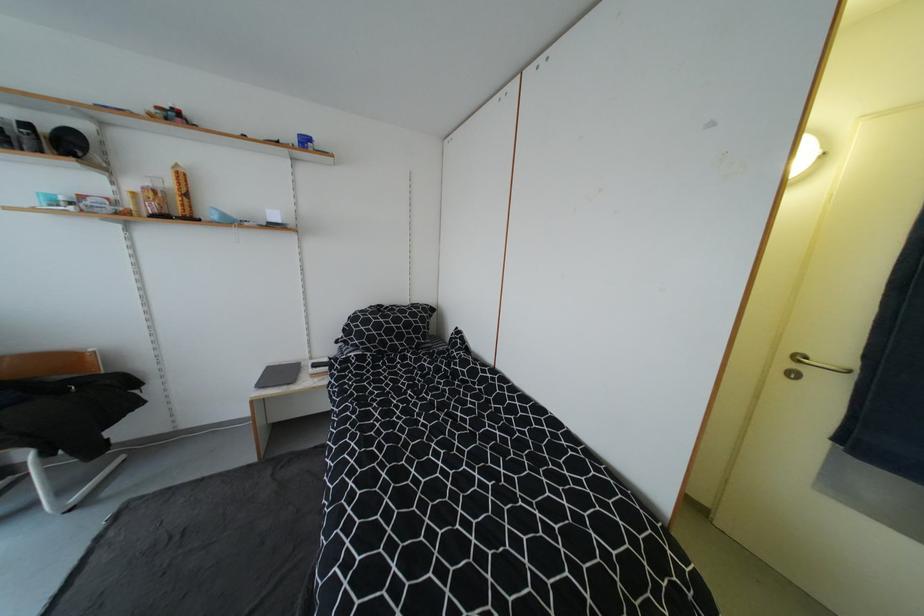
This screenshot has width=924, height=616. Find the location of `small blue box`. small blue box is located at coordinates (305, 140).